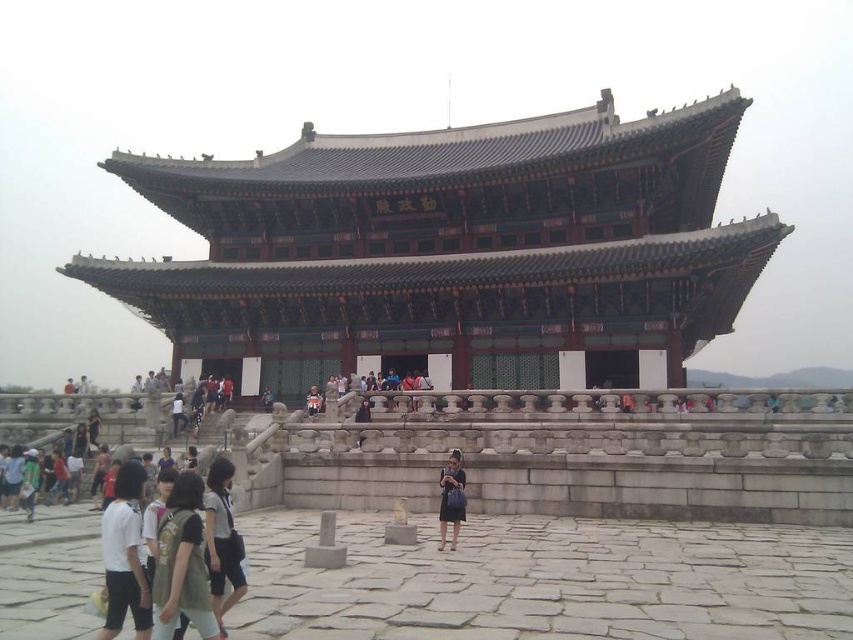
You are a tourist standing in front of the polished wood palace at center. You want to take a photo of the palace from a distance where it will appear as small as possible in your camera frame. Considering the palace is 196.42 feet away, what is the farthest distance you can move away from the palace while still keeping it entirely within your camera frame?

The farthest distance you can move away from the polished wood palace at center while keeping it entirely within your camera frame is 196.42 feet, as that is the current distance. Moving farther away would cause the palace to become too small to fit within the camera frame.

Based on the photo, you are a fashion designer observing the scene in the image. You notice two garments at the center of the courtyard. Which garment is taller, the matte black dress at center or the light brown leather jacket at center?

The matte black dress at center is much taller than the light brown leather jacket at center.

You are a photographer planning to capture a photo of the white cotton shirt at lower left and the matte black dress at center in the courtyard. Which clothing item should you focus on first if you want to include both in a single frame without moving the camera?

You should focus on the white cotton shirt at lower left first because it is much taller than the matte black dress at center, ensuring it fits within the frame when adjusting the camera angle or zoom.